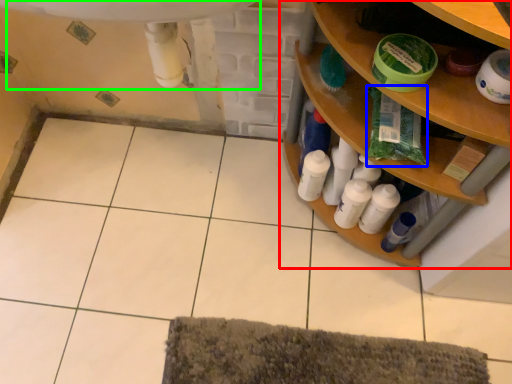
Question: Estimate the real-world distances between objects in this image. Which object is closer to shelf (highlighted by a red box), material (highlighted by a blue box) or sink (highlighted by a green box)?

Choices:
 (A) material
 (B) sink

Answer: (A)